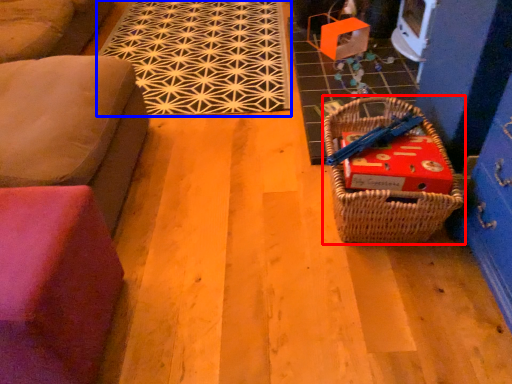
Question: Which object appears closest to the camera in this image, picnic basket (highlighted by a red box) or mat (highlighted by a blue box)?

Choices:
 (A) picnic basket
 (B) mat

Answer: (A)